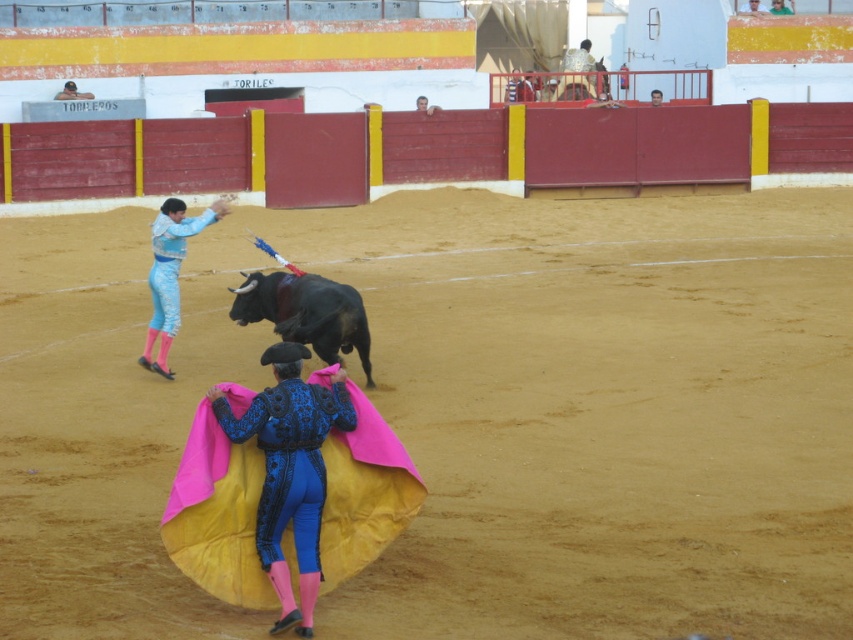
Question: Can you confirm if blue velvet suit at center is positioned to the right of light blue satin suit at left?

Choices:
 (A) yes
 (B) no

Answer: (A)

Question: Which point is farther to the camera?

Choices:
 (A) shiny black bull at center
 (B) light blue satin suit at left

Answer: (B)

Question: Does shiny black bull at center have a smaller size compared to light blue satin suit at left?

Choices:
 (A) no
 (B) yes

Answer: (A)

Question: Among these objects, which one is nearest to the camera?

Choices:
 (A) pink fabric at center
 (B) shiny black bull at center

Answer: (B)

Question: Does blue velvet suit at center have a larger size compared to light blue satin suit at left?

Choices:
 (A) yes
 (B) no

Answer: (A)

Question: Which point is farther from the camera taking this photo?

Choices:
 (A) (155, 243)
 (B) (781, 1)
 (C) (76, 88)

Answer: (B)